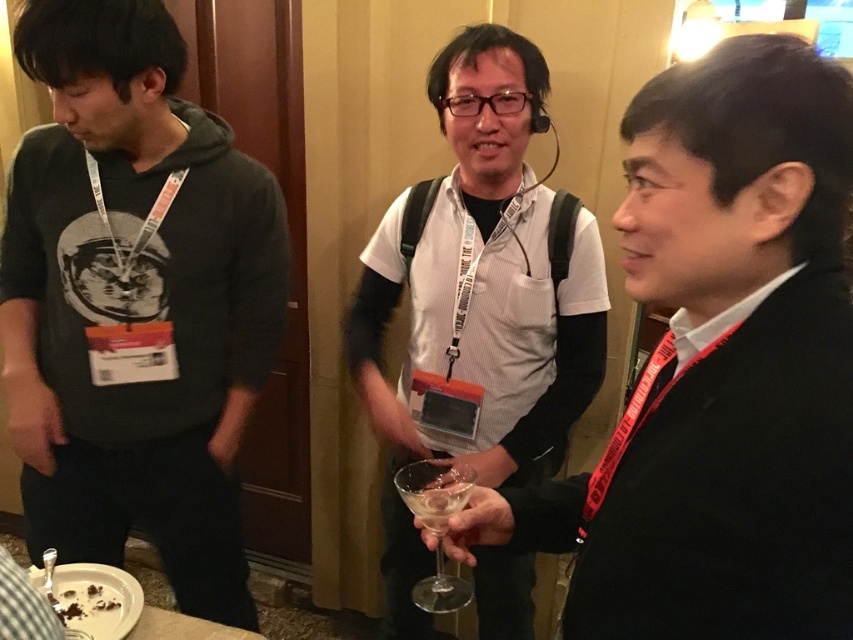
Which of these two, matte black hoodie at left or transparent glass wine glass at center, stands shorter?

transparent glass wine glass at center is shorter.

Is point (82, 131) positioned behind point (437, 540)?

Yes.

The height and width of the screenshot is (640, 853). I want to click on matte black hoodie at left, so click(x=135, y=301).

From the picture: Does matte black hoodie at left have a lesser width compared to clear glass at center?

No.

Which is in front, point (193, 150) or point (421, 483)?

Point (421, 483)

Identify the location of matte black hoodie at left. The height and width of the screenshot is (640, 853). (135, 301).

Is matte black hoodie at left taller than white striped shirt at center?

No.

Can you confirm if matte black hoodie at left is wider than white striped shirt at center?

Correct, the width of matte black hoodie at left exceeds that of white striped shirt at center.

The width and height of the screenshot is (853, 640). I want to click on matte black hoodie at left, so click(135, 301).